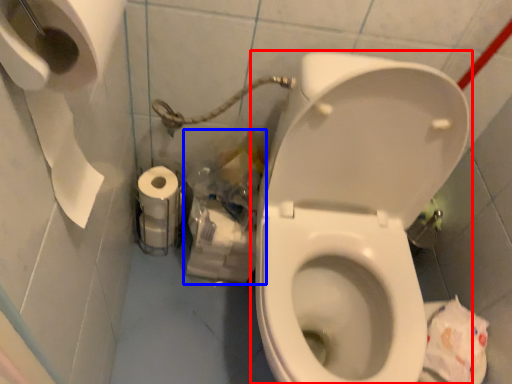
Question: Among these objects, which one is farthest to the camera, toilet (highlighted by a red box) or garbage (highlighted by a blue box)?

Choices:
 (A) toilet
 (B) garbage

Answer: (B)